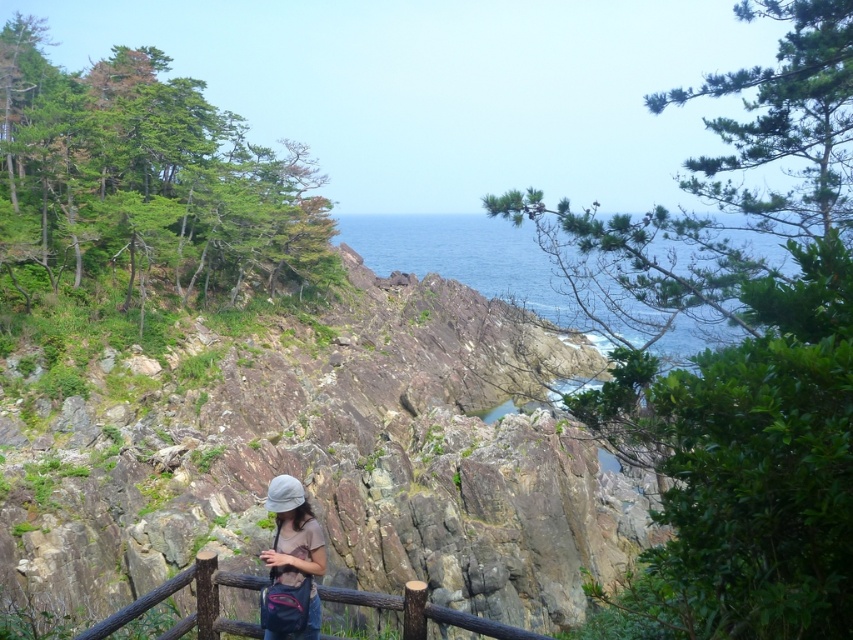
Question: Is blue water at center wider than brown wooden fence at lower center?

Choices:
 (A) no
 (B) yes

Answer: (B)

Question: Which point is closer to the camera taking this photo?

Choices:
 (A) tap(453, 609)
 (B) tap(300, 563)
 (C) tap(512, 282)
 (D) tap(337, 502)

Answer: (B)

Question: Does brown wooden fence at lower center appear under matte gray hat at center?

Choices:
 (A) yes
 (B) no

Answer: (A)

Question: Which point appears closest to the camera in this image?

Choices:
 (A) (412, 618)
 (B) (463, 371)
 (C) (293, 534)
 (D) (485, 289)

Answer: (A)

Question: Is rusty stone hillside at center smaller than brown wooden fence at lower center?

Choices:
 (A) no
 (B) yes

Answer: (A)

Question: Based on their relative distances, which object is nearer to the rusty stone hillside at center?

Choices:
 (A) matte gray hat at center
 (B) blue water at center

Answer: (A)